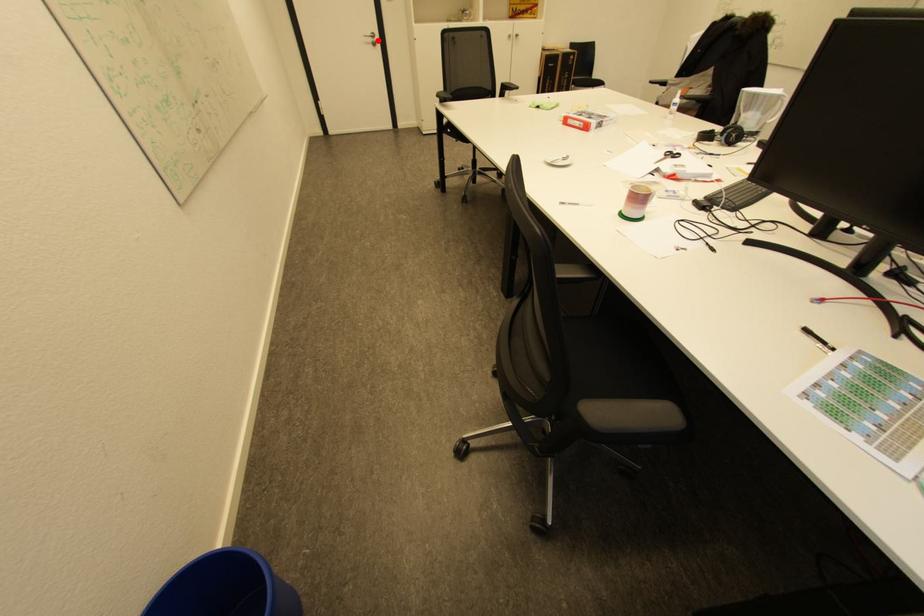
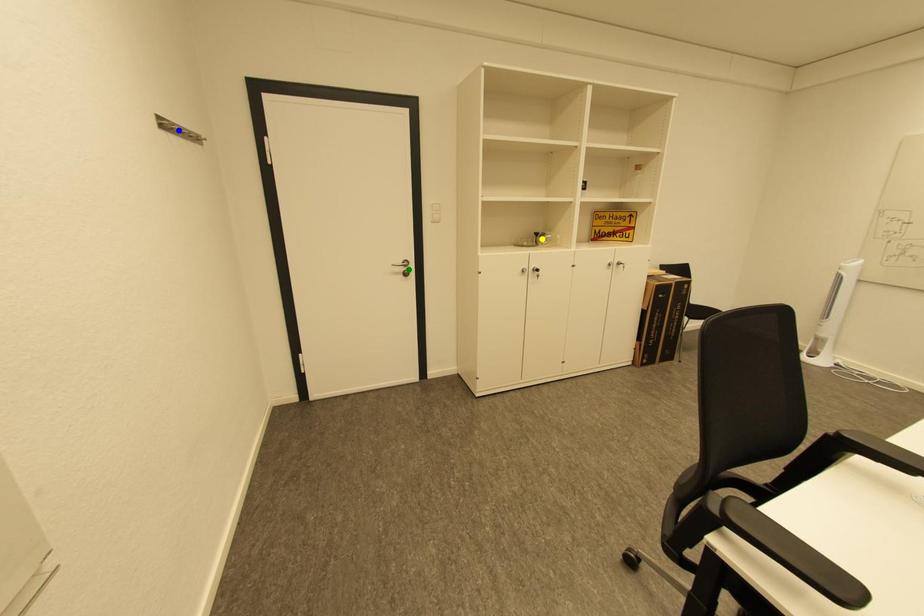
Question: I am providing you with two images of the same scene from different viewpoints. A red point is marked on the first image. You are given multiple points on the second image. Which point in image 2 represents the same 3d spot as the red point in image 1?

Choices:
 (A) green point
 (B) blue point
 (C) yellow point

Answer: (A)